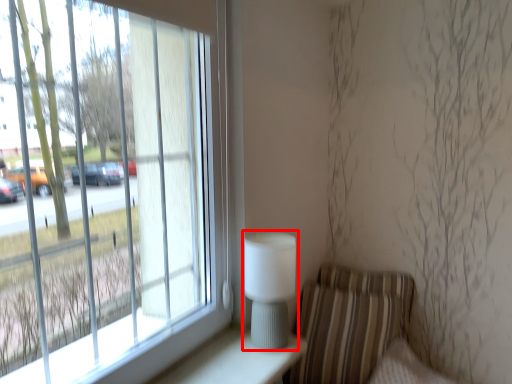
Question: From the image's perspective, what is the correct spatial positioning of table lamp (annotated by the red box) in reference to armchair?

Choices:
 (A) above
 (B) below

Answer: (A)